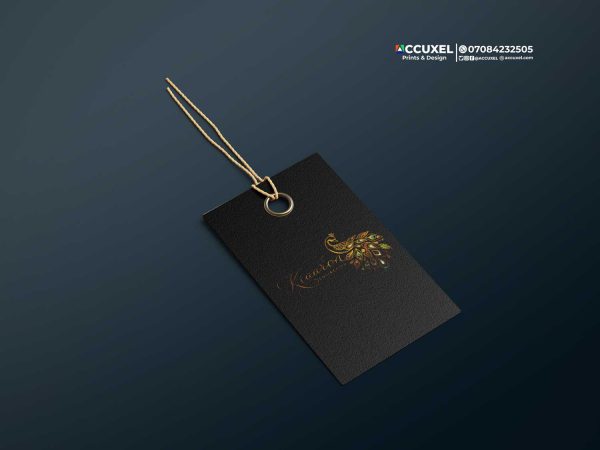
You are a GUI agent. You are given a task and a screenshot of the screen. Output one action in this format:
    pyautogui.click(x=<x>, y=<y>)
    Task: Click on the prints
    
    Given the screenshot: What is the action you would take?
    pyautogui.click(x=407, y=59)